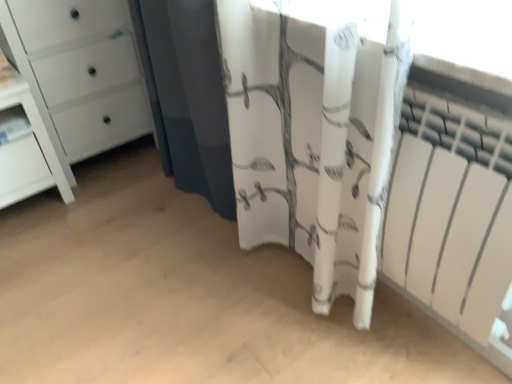
Identify the location of free space to the left of white floral fabric at center. The width and height of the screenshot is (512, 384). coord(98,207).